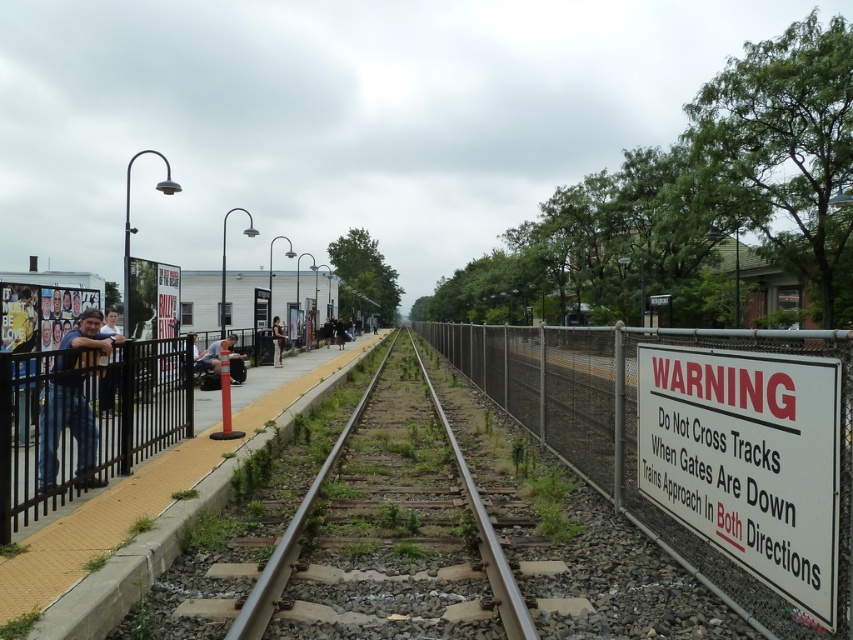
Question: Is blue denim jeans at left to the left of dark blue jeans at left from the viewer's perspective?

Choices:
 (A) yes
 (B) no

Answer: (B)

Question: Which point is closer to the camera?

Choices:
 (A) matte black backpack at center
 (B) black metal fence at left
 (C) light brown leather jacket at center

Answer: (B)

Question: Is white paper sign at right wider than matte black backpack at center?

Choices:
 (A) yes
 (B) no

Answer: (B)

Question: Which of the following is the farthest from the observer?

Choices:
 (A) (276, 353)
 (B) (73, 340)
 (C) (543, 406)

Answer: (A)

Question: Is black metal fence at left further to the viewer compared to light brown leather jacket at center?

Choices:
 (A) yes
 (B) no

Answer: (B)

Question: Which of the following is the closest to the observer?

Choices:
 (A) light brown leather jacket at center
 (B) black metal fence at left

Answer: (B)